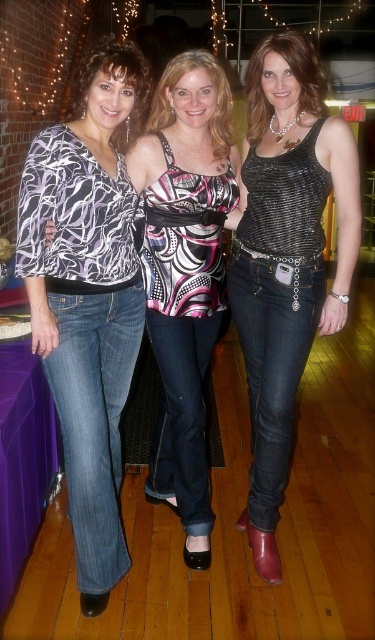
Question: Does sparkly metallic tank top at center appear on the left side of matte black blouse at center?

Choices:
 (A) yes
 (B) no

Answer: (B)

Question: Which object is the farthest from the matte black top at center?

Choices:
 (A) sparkly metallic tank top at center
 (B) printed jersey top at left
 (C) matte black blouse at center

Answer: (C)

Question: Which point appears closest to the camera in this image?

Choices:
 (A) (226, 125)
 (B) (127, 136)
 (C) (120, 483)
 (D) (279, 76)

Answer: (D)

Question: Is matte black top at center smaller than matte black blouse at center?

Choices:
 (A) yes
 (B) no

Answer: (B)

Question: Estimate the real-world distances between objects in this image. Which object is farther from the printed jersey top at left?

Choices:
 (A) matte black top at center
 (B) matte pink tank top at center
 (C) sparkly silver tank top at center
 (D) matte black blouse at center

Answer: (C)

Question: Is sparkly metallic tank top at center further to the viewer compared to sparkly silver tank top at center?

Choices:
 (A) no
 (B) yes

Answer: (A)